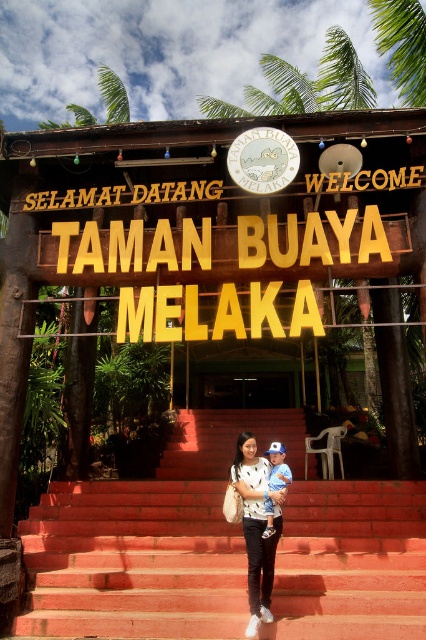
Question: Does red brick stairs at center lie behind blue cotton shirt at center?

Choices:
 (A) no
 (B) yes

Answer: (A)

Question: Can you confirm if red brick stairs at center is positioned above blue cotton shirt at center?

Choices:
 (A) yes
 (B) no

Answer: (B)

Question: Is red brick stairs at center above white matte dress at center?

Choices:
 (A) yes
 (B) no

Answer: (B)

Question: Which of the following is the closest to the observer?

Choices:
 (A) (222, 621)
 (B) (267, 486)

Answer: (A)

Question: Which of the following is the closest to the observer?

Choices:
 (A) white matte dress at center
 (B) red brick stairs at center
 (C) blue cotton shirt at center

Answer: (A)

Question: Which object is farther from the camera taking this photo?

Choices:
 (A) blue cotton shirt at center
 (B) red brick stairs at center

Answer: (A)